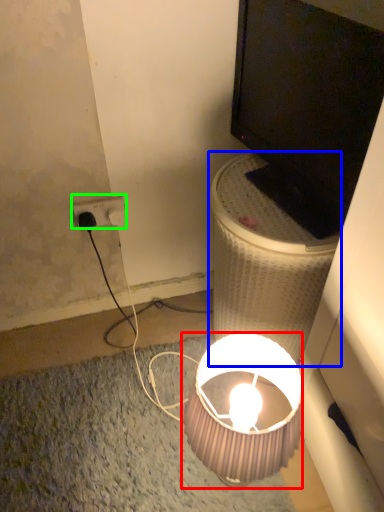
Question: Which is farther away from lamp (highlighted by a red box)? table (highlighted by a blue box) or power outlet (highlighted by a green box)?

Choices:
 (A) table
 (B) power outlet

Answer: (B)